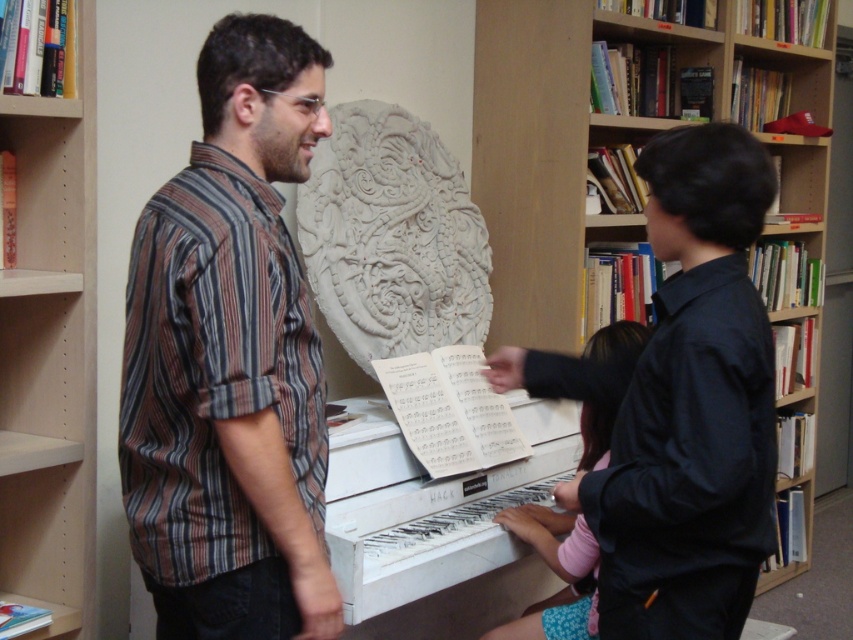
Question: Which is nearer to the wooden bookshelf at upper center?

Choices:
 (A) light brown wood bookshelf at left
 (B) white matte piano at center
 (C) pink fabric at piano

Answer: (B)

Question: Does striped cotton shirt at center lie in front of wooden bookshelf at upper center?

Choices:
 (A) yes
 (B) no

Answer: (A)

Question: Can you confirm if wooden bookshelf at upper center is smaller than light brown wood bookshelf at left?

Choices:
 (A) no
 (B) yes

Answer: (A)

Question: Among these objects, which one is nearest to the camera?

Choices:
 (A) striped cotton shirt at center
 (B) light brown wood bookshelf at left
 (C) wooden bookshelf at upper center

Answer: (A)

Question: Which point is farther from the camera taking this photo?

Choices:
 (A) (791, 141)
 (B) (16, 248)
 (C) (265, 529)

Answer: (A)

Question: Can you confirm if light brown wood bookshelf at left is positioned above pink fabric at piano?

Choices:
 (A) yes
 (B) no

Answer: (A)